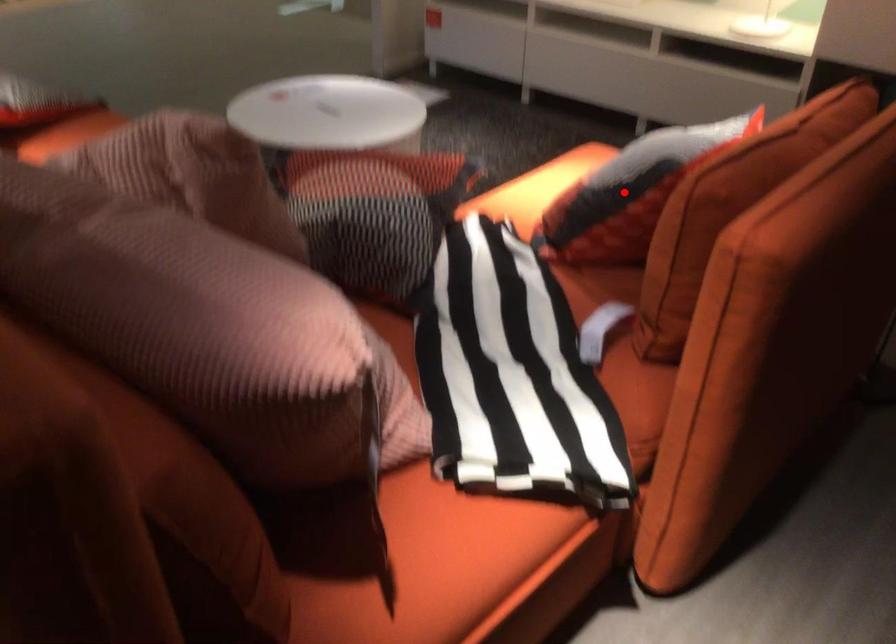
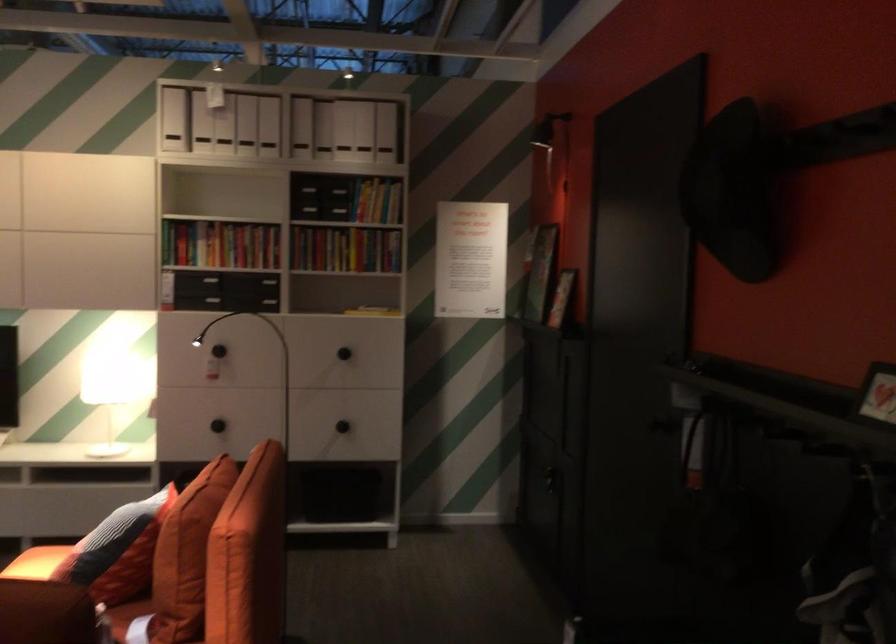
Question: I am providing you with two images of the same scene from different viewpoints. Image1 has a red point marked. In image2, the corresponding 3D location appears at what relative position? Reply with the corresponding letter.

Choices:
 (A) Closer
 (B) Farther

Answer: (B)